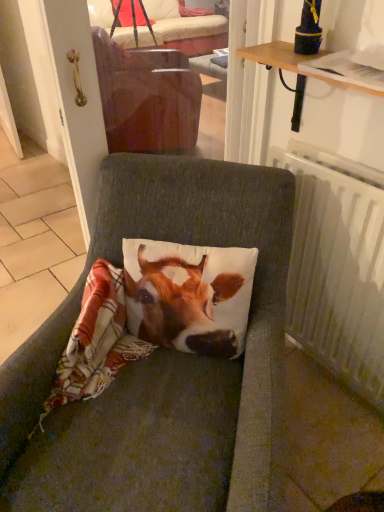
Question: From a real-world perspective, is textured gray cushion at center under white plastic radiator at right?

Choices:
 (A) no
 (B) yes

Answer: (B)

Question: Is the position of textured gray cushion at center more distant than that of white plastic radiator at right?

Choices:
 (A) no
 (B) yes

Answer: (A)

Question: From the image's perspective, is textured gray cushion at center below white plastic radiator at right?

Choices:
 (A) no
 (B) yes

Answer: (B)

Question: From the image's perspective, would you say textured gray cushion at center is positioned over white plastic radiator at right?

Choices:
 (A) yes
 (B) no

Answer: (B)

Question: Is textured gray cushion at center surrounding white plastic radiator at right?

Choices:
 (A) no
 (B) yes

Answer: (A)

Question: From a real-world perspective, is textured gray cushion at center physically above white plastic radiator at right?

Choices:
 (A) no
 (B) yes

Answer: (A)

Question: Is white plastic radiator at right in contact with textured gray cushion at center?

Choices:
 (A) no
 (B) yes

Answer: (A)

Question: From the image's perspective, is white plastic radiator at right on textured gray cushion at center?

Choices:
 (A) no
 (B) yes

Answer: (B)

Question: Is white plastic radiator at right wider than textured gray cushion at center?

Choices:
 (A) no
 (B) yes

Answer: (A)

Question: Considering the relative sizes of white plastic radiator at right and textured gray cushion at center in the image provided, is white plastic radiator at right bigger than textured gray cushion at center?

Choices:
 (A) yes
 (B) no

Answer: (B)

Question: Would you consider white plastic radiator at right to be distant from textured gray cushion at center?

Choices:
 (A) no
 (B) yes

Answer: (A)

Question: Is white plastic radiator at right thinner than textured gray cushion at center?

Choices:
 (A) yes
 (B) no

Answer: (A)

Question: Considering the positions of textured gray cushion at center and white plastic radiator at right in the image, is textured gray cushion at center wider or thinner than white plastic radiator at right?

Choices:
 (A) thin
 (B) wide

Answer: (B)